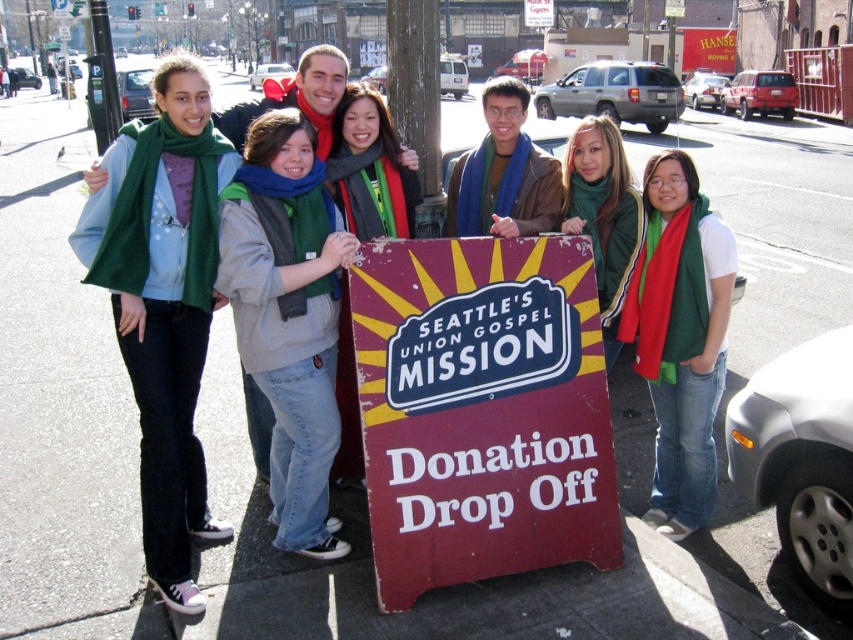
Looking at this image, is gray fleece vest at center above red scarf at center?

Indeed, gray fleece vest at center is positioned over red scarf at center.

Is gray fleece vest at center to the right of red scarf at center from the viewer's perspective?

No, gray fleece vest at center is not to the right of red scarf at center.

Does point (267, 321) lie in front of point (706, 262)?

Yes, point (267, 321) is in front of point (706, 262).

Where is `gray fleece vest at center`? The width and height of the screenshot is (853, 640). gray fleece vest at center is located at coordinates (x=289, y=316).

Who is lower down, gray fleece vest at center or blue scarf at center?

gray fleece vest at center is lower down.

Is gray fleece vest at center to the left of blue scarf at center from the viewer's perspective?

Yes, gray fleece vest at center is to the left of blue scarf at center.

The image size is (853, 640). Identify the location of gray fleece vest at center. [x=289, y=316].

Is green fleece jacket at left behind blue scarf at center?

No, it is not.

Who is positioned more to the left, green fleece jacket at left or blue scarf at center?

green fleece jacket at left

Where is `green fleece jacket at left`? The image size is (853, 640). green fleece jacket at left is located at coordinates (164, 304).

You are a GUI agent. You are given a task and a screenshot of the screen. Output one action in this format:
    pyautogui.click(x=<x>, y=<y>)
    Task: Click on the green fleece jacket at left
    The image size is (853, 640).
    Given the screenshot: What is the action you would take?
    pyautogui.click(x=164, y=304)